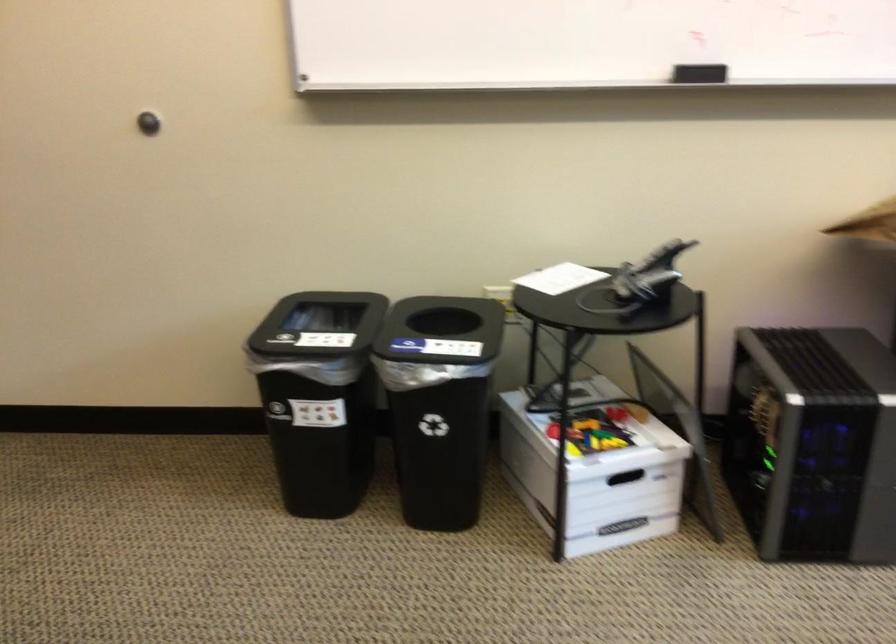
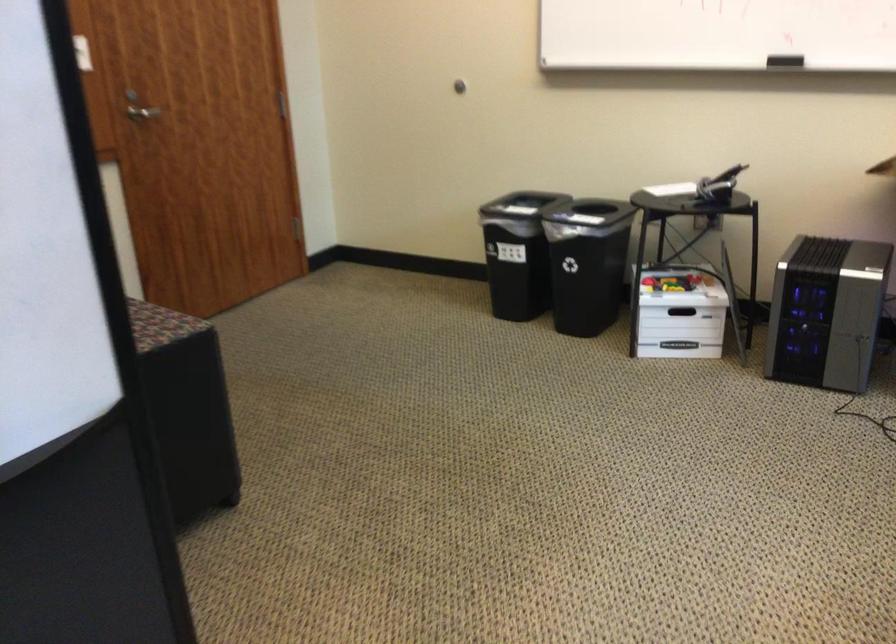
The images are taken continuously from a first-person perspective. In which direction are you moving?

The cameraman moved toward right, backward.